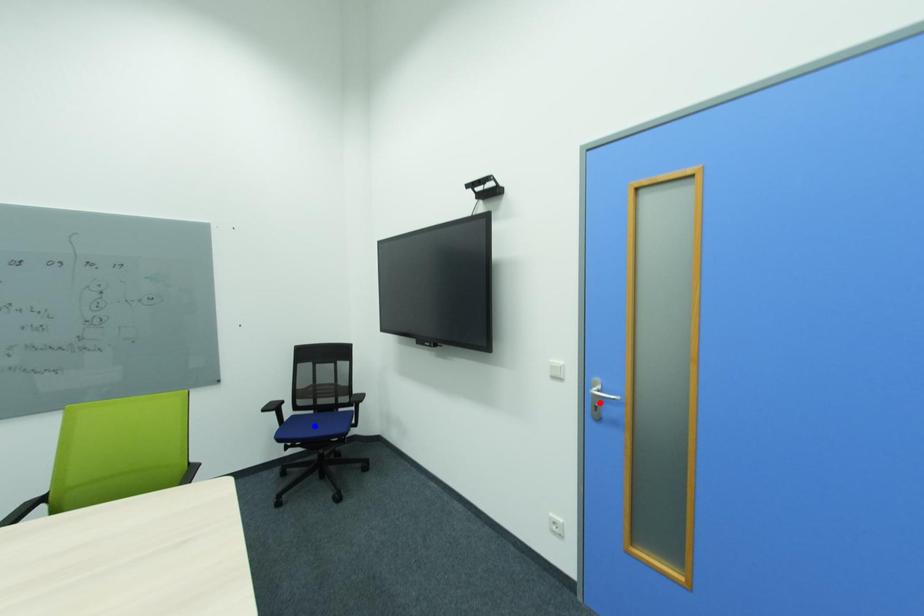
Question: Two points are marked on the image. Which point is closer to the camera?

Choices:
 (A) Blue point is closer.
 (B) Red point is closer.

Answer: (B)